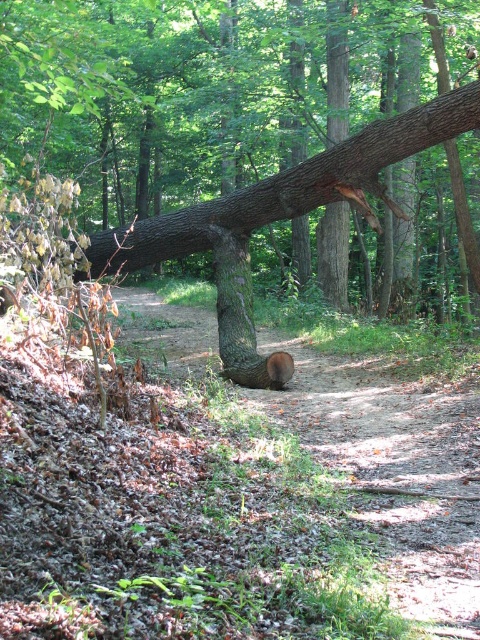
Is brown rough tree stump at center to the right of brown rough tree trunk at center from the viewer's perspective?

Indeed, brown rough tree stump at center is positioned on the right side of brown rough tree trunk at center.

Looking at this image, can you confirm if brown rough tree stump at center is bigger than brown rough tree trunk at center?

Yes, brown rough tree stump at center is bigger than brown rough tree trunk at center.

Who is more forward, (444, 520) or (217, 269)?

Point (444, 520)

Where is `brown rough tree stump at center`? Image resolution: width=480 pixels, height=640 pixels. brown rough tree stump at center is located at coordinates (394, 472).

You are a GUI agent. You are given a task and a screenshot of the screen. Output one action in this format:
    pyautogui.click(x=<x>, y=<y>)
    Task: Click on the smooth brown log at center
    The height and width of the screenshot is (640, 480).
    Given the screenshot: What is the action you would take?
    279,220

Is the position of brown rough tree stump at center less distant than that of smooth brown log at center?

Yes, brown rough tree stump at center is in front of smooth brown log at center.

Does brown rough tree stump at center have a lesser width compared to smooth brown log at center?

Yes, brown rough tree stump at center is thinner than smooth brown log at center.

Between point (435, 422) and point (240, 193), which one is positioned behind?

Positioned behind is point (240, 193).

Find the location of a particular element. brown rough tree stump at center is located at coordinates (394, 472).